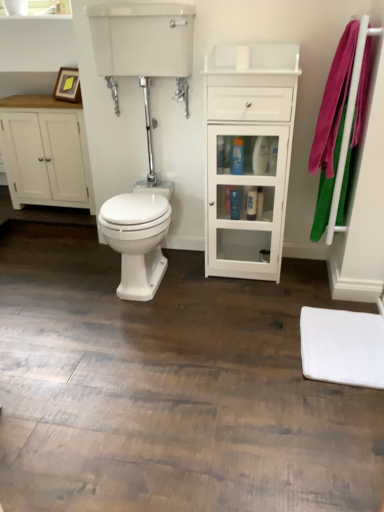
This screenshot has height=512, width=384. I want to click on vacant region to the left of white matte mat at lower right, so (x=257, y=349).